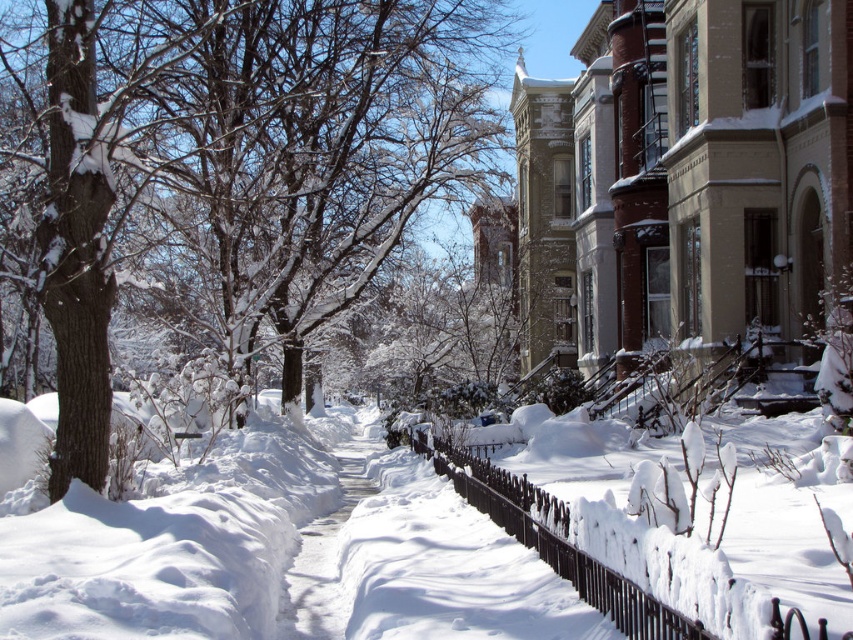
Question: Which object is closer to the camera taking this photo?

Choices:
 (A) snow-covered tree at center
 (B) white snow at center

Answer: (B)

Question: Can you confirm if black wrought iron fence at center is positioned to the right of white snow at center?

Choices:
 (A) yes
 (B) no

Answer: (A)

Question: Which object is closer to the camera taking this photo?

Choices:
 (A) black wrought iron fence at center
 (B) snow-covered tree at center
 (C) white snow at center

Answer: (A)

Question: Which object is closer to the camera taking this photo?

Choices:
 (A) white fluffy snow at center
 (B) black wrought iron fence at center
 (C) white snow at center
 (D) snow-covered tree at center

Answer: (A)

Question: Is white fluffy snow at center in front of black wrought iron fence at center?

Choices:
 (A) no
 (B) yes

Answer: (B)

Question: Is snow-covered tree at center positioned at the back of white fluffy snow at center?

Choices:
 (A) no
 (B) yes

Answer: (B)